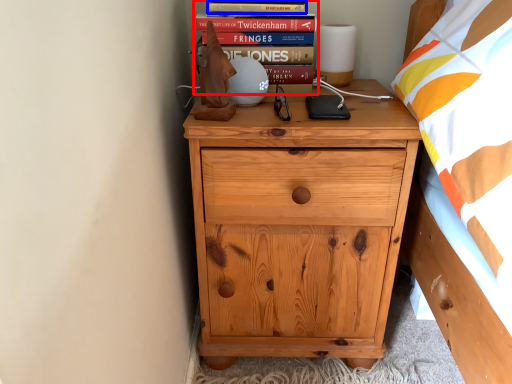
Question: Which of the following is the closest to the observer, book (highlighted by a red box) or paperback book (highlighted by a blue box)?

Choices:
 (A) book
 (B) paperback book

Answer: (B)